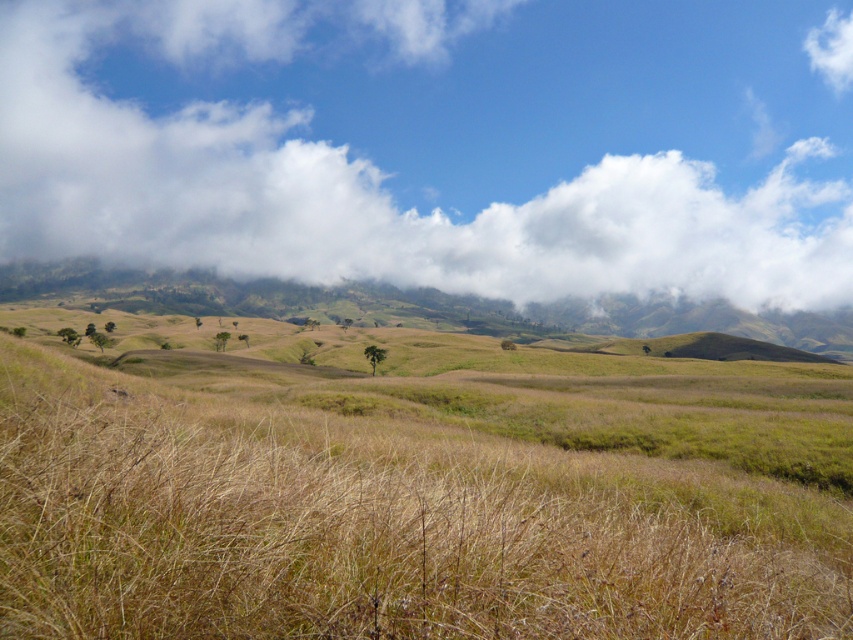
Is white fluffy cloud at upper center below dry grass at center?

Incorrect, white fluffy cloud at upper center is not positioned below dry grass at center.

Between point (776, 32) and point (15, 602), which one is positioned in front?

Point (15, 602) is in front.

Does point (202, 12) lie behind point (585, 545)?

That is True.

Identify the location of white fluffy cloud at upper center. The image size is (853, 640). (440, 147).